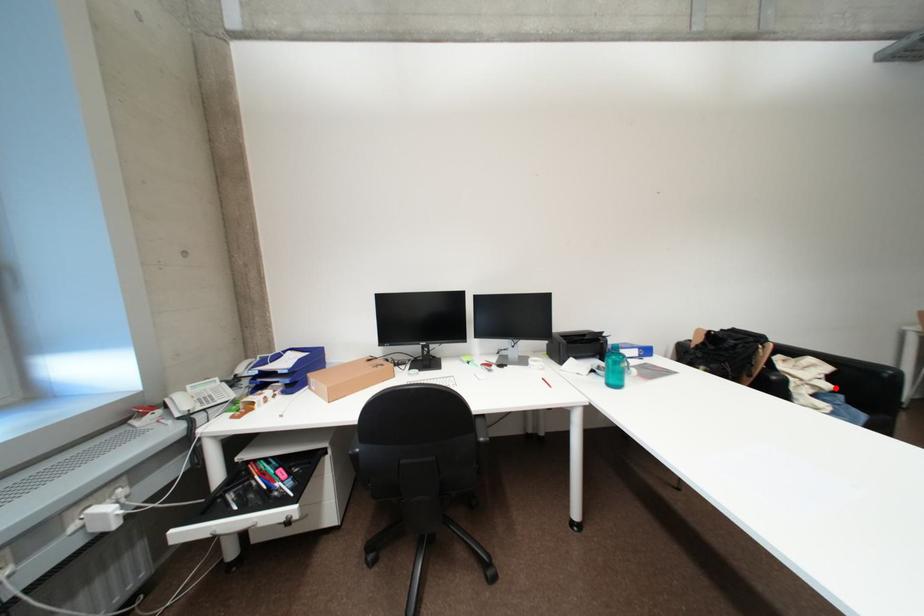
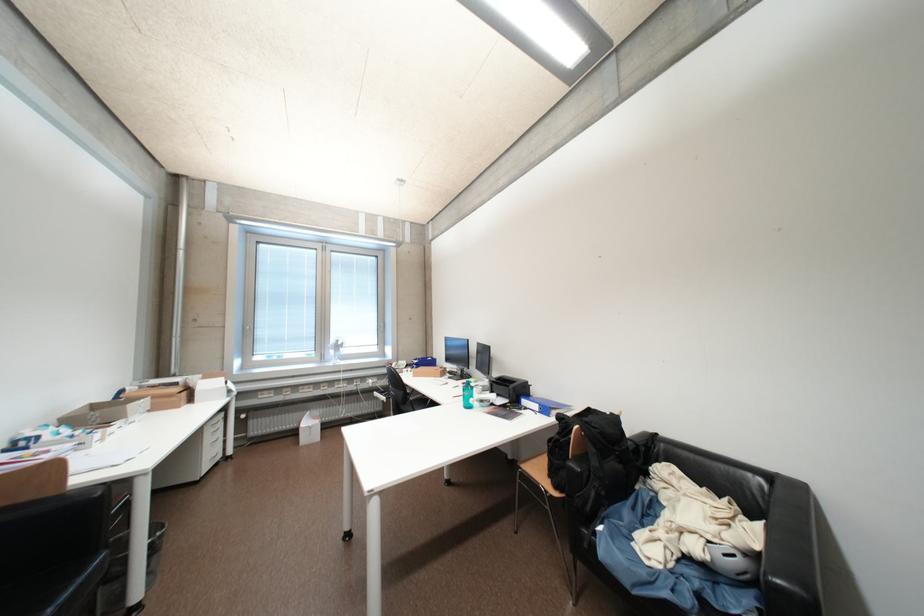
The point at the highlighted location is marked in the first image. Where is the corresponding point in the second image?

(704, 551)